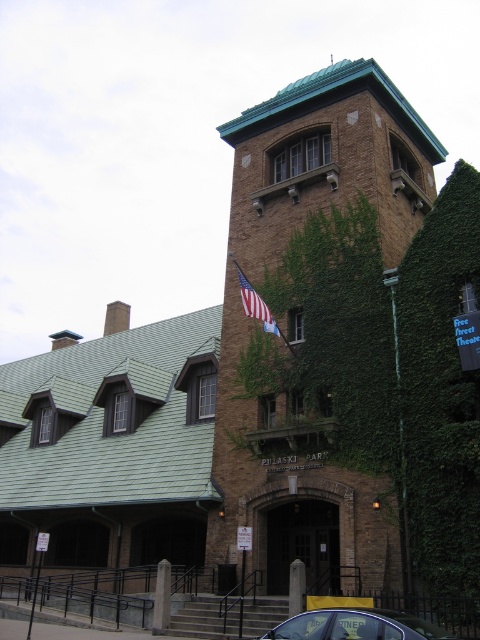
Question: Does green ivy-covered brick bell tower at upper center have a lesser width compared to american flag at center?

Choices:
 (A) no
 (B) yes

Answer: (A)

Question: Which point is farther to the camera?

Choices:
 (A) (263, 316)
 (B) (314, 81)
 (C) (276, 637)

Answer: (B)

Question: Among these objects, which one is nearest to the camera?

Choices:
 (A) metallic blue car at lower center
 (B) american flag at center
 (C) green ivy-covered brick bell tower at upper center

Answer: (A)

Question: Which point appears farthest from the camera in this image?

Choices:
 (A) (266, 636)
 (B) (255, 307)

Answer: (B)

Question: In this image, where is metallic blue car at lower center located relative to american flag at center?

Choices:
 (A) left
 (B) right

Answer: (B)

Question: Does green ivy-covered brick bell tower at upper center come in front of american flag at center?

Choices:
 (A) yes
 (B) no

Answer: (A)